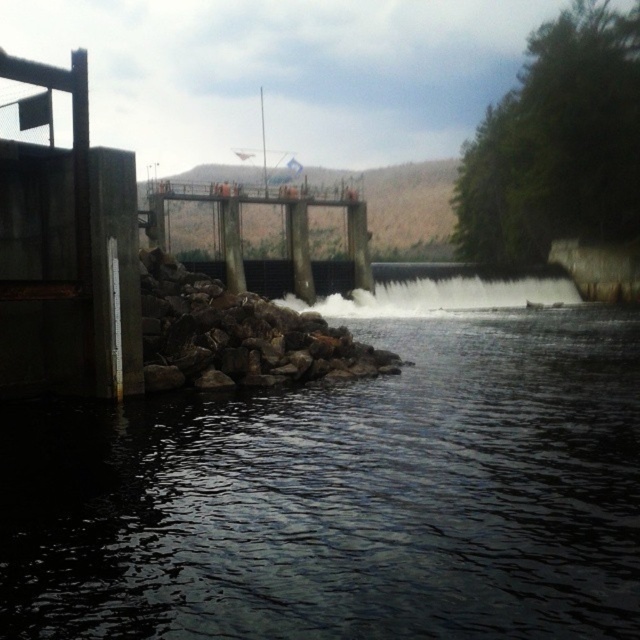
Question: Among these points, which one is farthest from the camera?

Choices:
 (A) (211, 285)
 (B) (76, 424)

Answer: (A)

Question: Which point appears farthest from the camera in this image?

Choices:
 (A) (442, 452)
 (B) (291, 365)

Answer: (B)

Question: Does dark gray water at lower left have a smaller size compared to rocky pile at lower left?

Choices:
 (A) yes
 (B) no

Answer: (A)

Question: Does dark gray water at lower left appear under rocky pile at lower left?

Choices:
 (A) no
 (B) yes

Answer: (B)

Question: From the image, what is the correct spatial relationship of dark gray water at lower left in relation to rocky pile at lower left?

Choices:
 (A) below
 (B) above

Answer: (A)